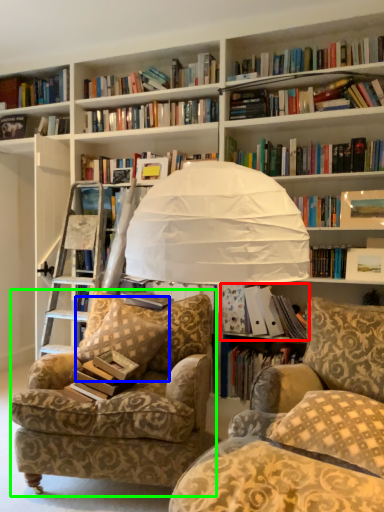
Question: Based on their relative distances, which object is farther from book (highlighted by a red box)? Choose from pillow (highlighted by a blue box) and chair (highlighted by a green box).

Choices:
 (A) pillow
 (B) chair

Answer: (B)